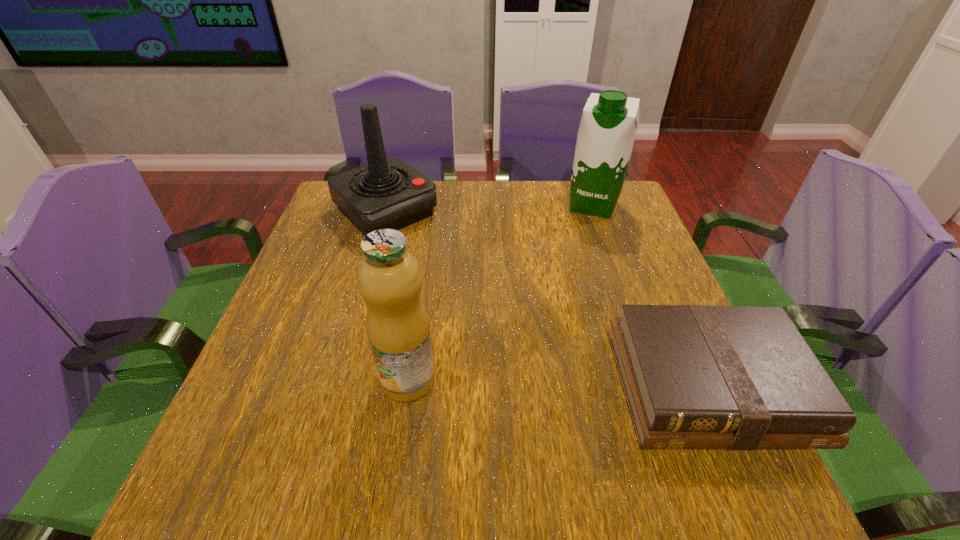
Find the location of `object at the near right corner`. object at the near right corner is located at coordinates pyautogui.click(x=694, y=376).

In the image, there is a desktop. What are the coordinates of `free space at the far edge` in the screenshot? It's located at (556, 194).

Identify the location of free space at the near edge of the desktop. The image size is (960, 540). (580, 410).

Where is `vacant point at the left edge`? Image resolution: width=960 pixels, height=540 pixels. vacant point at the left edge is located at coordinates pos(261,348).

Where is `empty space between the joystick and the shortest object`? This screenshot has height=540, width=960. empty space between the joystick and the shortest object is located at coordinates (547, 299).

Where is `free space between the Bible and the joystick`? free space between the Bible and the joystick is located at coordinates (547, 299).

At what (x,y) coordinates should I click in order to perform the action: click on free space that is in between the shortest object and the fruit juice. Please return your answer as a coordinate pair (x, y). Looking at the image, I should click on (559, 382).

Image resolution: width=960 pixels, height=540 pixels. I want to click on free space between the fruit juice and the shortest object, so click(559, 382).

I want to click on empty space that is in between the Bible and the soya milk, so click(651, 295).

Find the location of `free point between the joystick and the soya milk`. free point between the joystick and the soya milk is located at coordinates (490, 208).